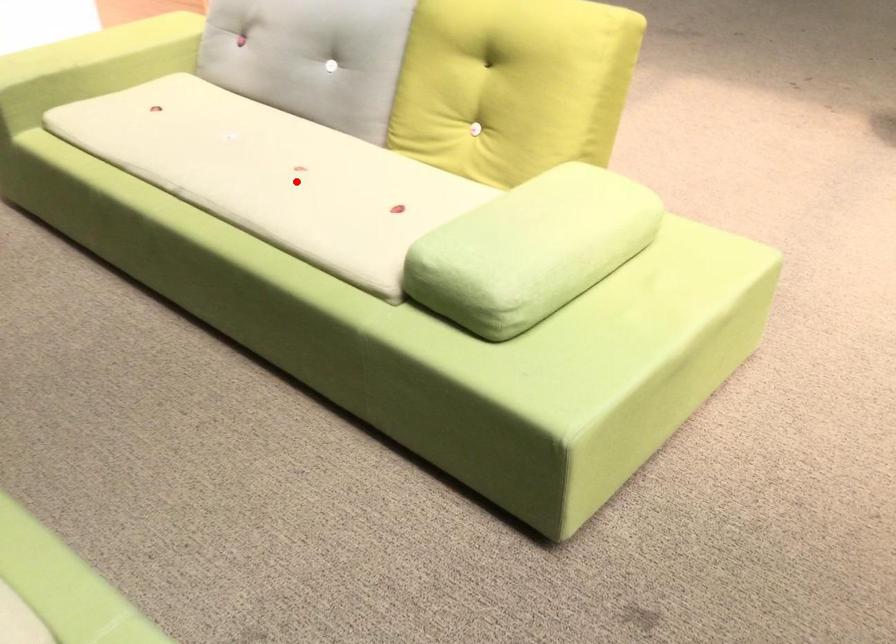
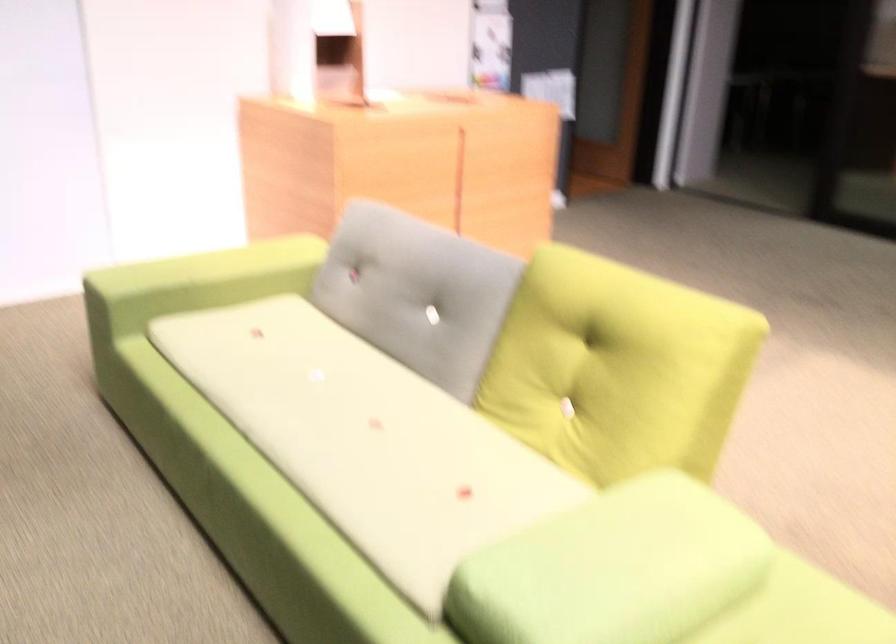
In the second image, find the point that corresponds to the highlighted location in the first image.

(366, 439)